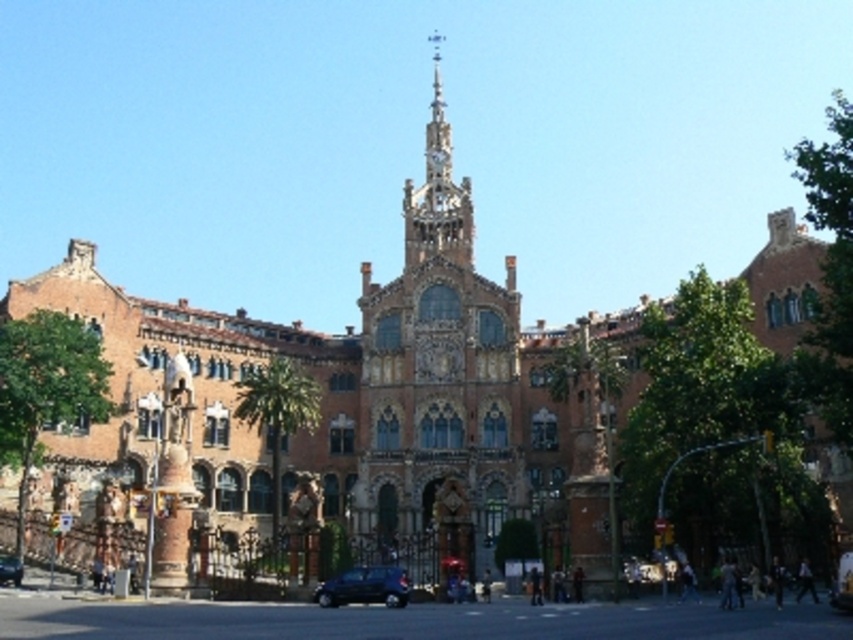
Question: Is golden ornate tower at center positioned in front of shiny black car at lower center?

Choices:
 (A) no
 (B) yes

Answer: (A)

Question: Which point is closer to the camera taking this photo?

Choices:
 (A) (425, 195)
 (B) (19, 568)
 (C) (358, 572)
 (D) (840, 598)

Answer: (D)

Question: Is golden ornate tower at center to the right of metallic blue car at center from the viewer's perspective?

Choices:
 (A) yes
 (B) no

Answer: (B)

Question: Can you confirm if golden ornate tower at center is smaller than metallic blue car at center?

Choices:
 (A) yes
 (B) no

Answer: (B)

Question: Based on their relative distances, which object is nearer to the golden stone clock tower at center?

Choices:
 (A) golden ornate tower at center
 (B) shiny black car at lower center
 (C) metallic blue car at center
 (D) metallic blue car at lower left

Answer: (A)

Question: Among these points, which one is nearest to the camera?

Choices:
 (A) (450, 177)
 (B) (480, 419)
 (C) (840, 579)

Answer: (C)